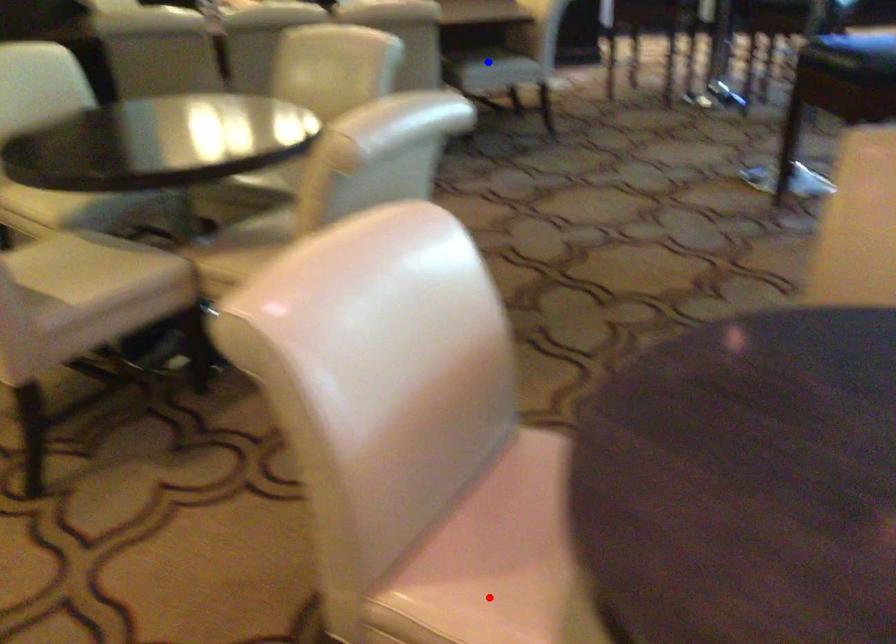
Question: In the image, two points are highlighted. Which point is nearer to the camera? Reply with the corresponding letter.

Choices:
 (A) blue point
 (B) red point

Answer: (B)